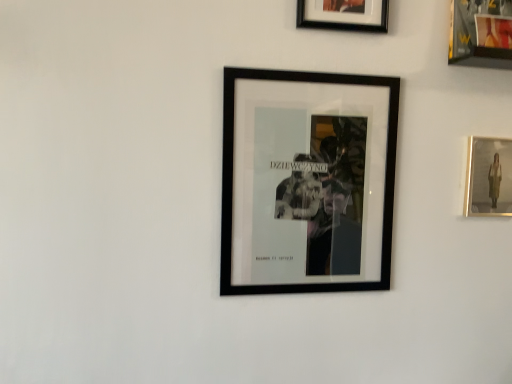
Question: In which direction should I rotate to look at black matte picture frame at upper center, which appears as the 3th picture frame when viewed from the right?

Choices:
 (A) right
 (B) left

Answer: (A)

Question: Would you say black matte picture frame at upper center, which ranks as the 2th picture frame in left-to-right order, contains black matte picture frame at center, which appears as the first picture frame when viewed from the left?

Choices:
 (A) no
 (B) yes

Answer: (A)

Question: Can you confirm if black matte picture frame at upper center, which appears as the 3th picture frame when viewed from the right, is positioned to the left of black matte picture frame at center, which appears as the 4th picture frame when viewed from the right?

Choices:
 (A) no
 (B) yes

Answer: (A)

Question: Is black matte picture frame at upper center, which appears as the 3th picture frame when viewed from the right, completely or partially outside of black matte picture frame at center, which appears as the 4th picture frame when viewed from the right?

Choices:
 (A) no
 (B) yes

Answer: (B)

Question: Is the depth of black matte picture frame at upper center, which ranks as the 2th picture frame in left-to-right order, less than that of black matte picture frame at center, which appears as the 4th picture frame when viewed from the right?

Choices:
 (A) no
 (B) yes

Answer: (A)

Question: From the image's perspective, does black matte picture frame at upper center, which ranks as the 2th picture frame in left-to-right order, appear higher than black matte picture frame at center, which appears as the first picture frame when viewed from the left?

Choices:
 (A) no
 (B) yes

Answer: (B)

Question: From a real-world perspective, is black matte picture frame at upper center, which ranks as the 2th picture frame in left-to-right order, below black matte picture frame at center, which appears as the 4th picture frame when viewed from the right?

Choices:
 (A) yes
 (B) no

Answer: (B)

Question: Considering the relative sizes of black matte picture frame at center, which appears as the first picture frame when viewed from the left, and metallic gold picture frame at upper right, which appears as the 2th picture frame when viewed from the right, in the image provided, is black matte picture frame at center, which appears as the first picture frame when viewed from the left, wider than metallic gold picture frame at upper right, which appears as the 2th picture frame when viewed from the right,?

Choices:
 (A) yes
 (B) no

Answer: (A)

Question: Is black matte picture frame at center, which appears as the first picture frame when viewed from the left, shorter than metallic gold picture frame at upper right, which appears as the 2th picture frame when viewed from the right?

Choices:
 (A) no
 (B) yes

Answer: (A)

Question: Can you confirm if black matte picture frame at center, which appears as the first picture frame when viewed from the left, is thinner than metallic gold picture frame at upper right, which appears as the 2th picture frame when viewed from the right?

Choices:
 (A) yes
 (B) no

Answer: (B)

Question: From the image's perspective, is black matte picture frame at center, which appears as the 4th picture frame when viewed from the right, located beneath metallic gold picture frame at upper right, which appears as the 2th picture frame when viewed from the right?

Choices:
 (A) yes
 (B) no

Answer: (A)

Question: From a real-world perspective, is black matte picture frame at center, which appears as the first picture frame when viewed from the left, positioned over metallic gold picture frame at upper right, which is the third picture frame in left-to-right order, based on gravity?

Choices:
 (A) yes
 (B) no

Answer: (B)

Question: Does black matte picture frame at center, which appears as the first picture frame when viewed from the left, have a greater height compared to metallic gold picture frame at upper right, which is the third picture frame in left-to-right order?

Choices:
 (A) yes
 (B) no

Answer: (A)

Question: Does metallic gold picture frame at upper right, which appears as the 2th picture frame when viewed from the right, have a smaller size compared to black matte picture frame at upper center, which ranks as the 2th picture frame in left-to-right order?

Choices:
 (A) yes
 (B) no

Answer: (B)